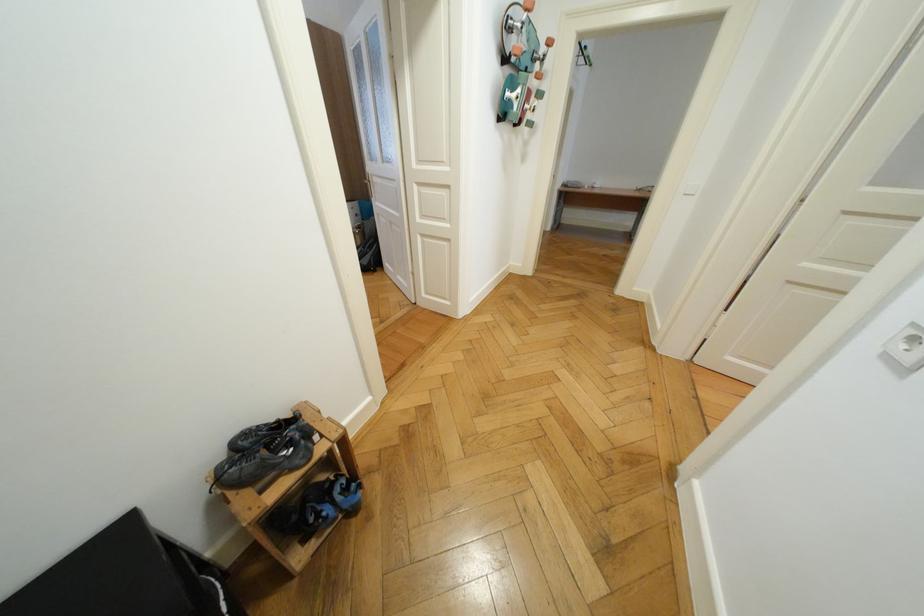
This screenshot has width=924, height=616. Describe the element at coordinates (690, 188) in the screenshot. I see `a white light switch` at that location.